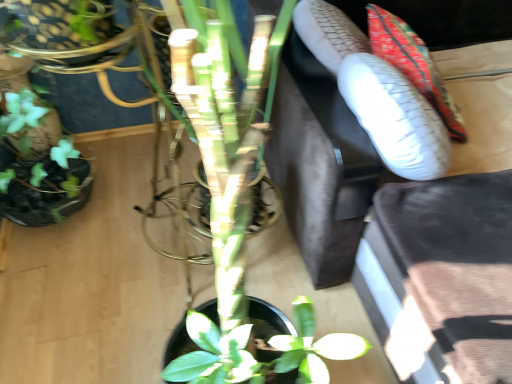
Question: Does velvet dark brown couch at upper right have a larger size compared to textured fabric cushion at upper right?

Choices:
 (A) no
 (B) yes

Answer: (B)

Question: From the image's perspective, is velvet dark brown couch at upper right under textured fabric cushion at upper right?

Choices:
 (A) no
 (B) yes

Answer: (B)

Question: From a real-world perspective, is velvet dark brown couch at upper right located higher than textured fabric cushion at upper right?

Choices:
 (A) yes
 (B) no

Answer: (B)

Question: Can you confirm if velvet dark brown couch at upper right is positioned to the right of textured fabric cushion at upper right?

Choices:
 (A) no
 (B) yes

Answer: (B)

Question: From the image's perspective, does velvet dark brown couch at upper right appear higher than textured fabric cushion at upper right?

Choices:
 (A) no
 (B) yes

Answer: (A)

Question: Considering the relative sizes of velvet dark brown couch at upper right and textured fabric cushion at upper right in the image provided, is velvet dark brown couch at upper right smaller than textured fabric cushion at upper right?

Choices:
 (A) yes
 (B) no

Answer: (B)

Question: From the image's perspective, is textured fabric cushion at upper right under velvet dark brown couch at upper right?

Choices:
 (A) yes
 (B) no

Answer: (B)

Question: Is textured fabric cushion at upper right at the right side of velvet dark brown couch at upper right?

Choices:
 (A) no
 (B) yes

Answer: (A)

Question: Considering the relative sizes of textured fabric cushion at upper right and velvet dark brown couch at upper right in the image provided, is textured fabric cushion at upper right taller than velvet dark brown couch at upper right?

Choices:
 (A) no
 (B) yes

Answer: (A)

Question: From a real-world perspective, is textured fabric cushion at upper right on top of velvet dark brown couch at upper right?

Choices:
 (A) yes
 (B) no

Answer: (A)

Question: Does textured fabric cushion at upper right turn towards velvet dark brown couch at upper right?

Choices:
 (A) yes
 (B) no

Answer: (A)

Question: Is textured fabric cushion at upper right in contact with velvet dark brown couch at upper right?

Choices:
 (A) yes
 (B) no

Answer: (B)

Question: Considering the positions of velvet dark brown couch at upper right and textured fabric cushion at upper right in the image, is velvet dark brown couch at upper right wider or thinner than textured fabric cushion at upper right?

Choices:
 (A) thin
 (B) wide

Answer: (B)